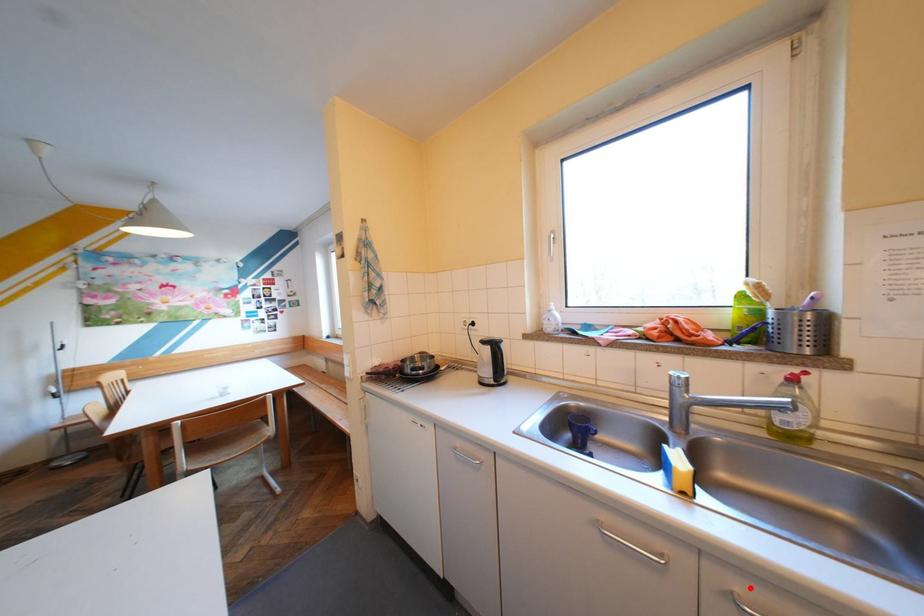
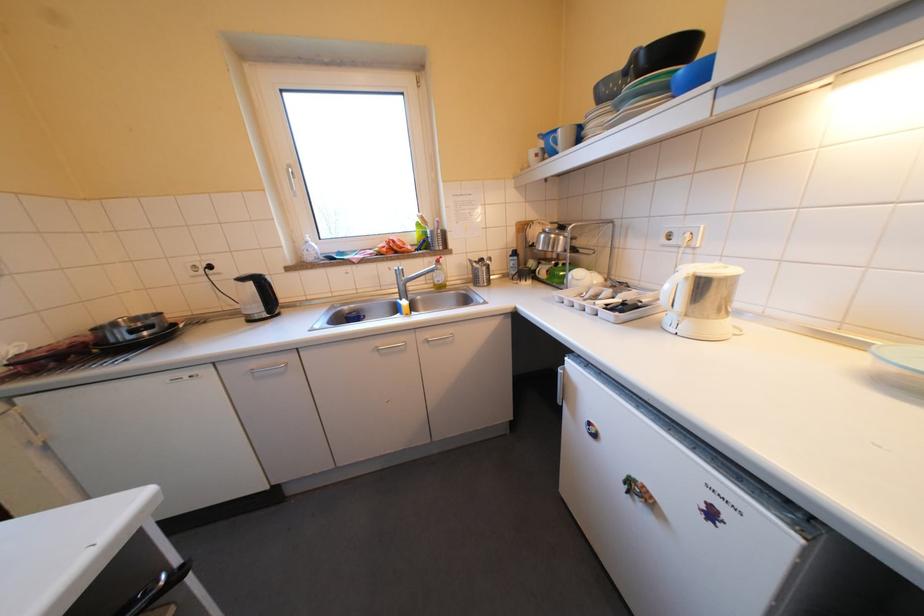
In the second image, find the point that corresponds to the highlighted location in the first image.

(440, 336)